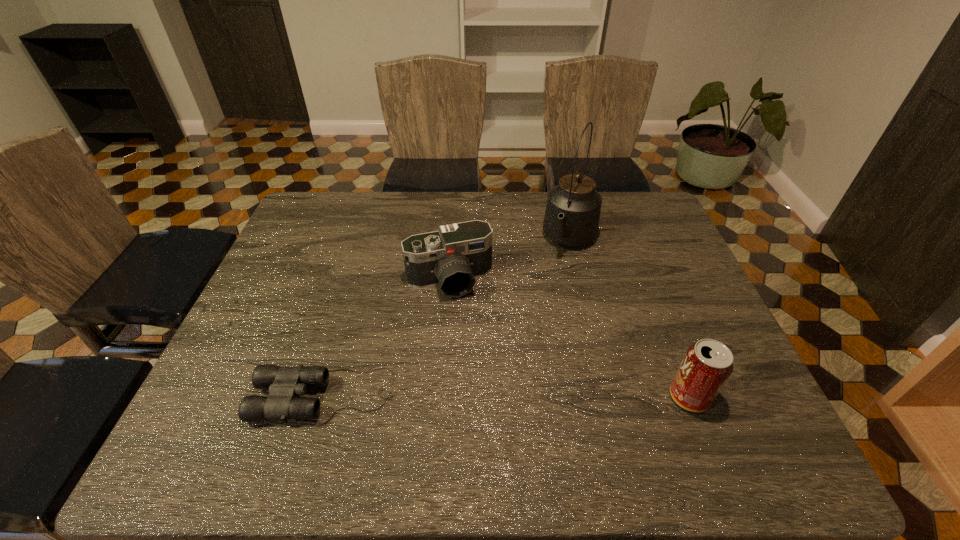
Where is `binoculars`? The width and height of the screenshot is (960, 540). binoculars is located at coordinates coord(284,383).

The image size is (960, 540). Identify the location of the rightmost object. (707, 365).

Where is `camera`? The width and height of the screenshot is (960, 540). camera is located at coordinates (454, 256).

At what (x,y) coordinates should I click in order to perform the action: click on the third object from left to right. Please return your answer as a coordinate pair (x, y). Looking at the image, I should click on (572, 214).

This screenshot has width=960, height=540. Identify the location of kettle. [x=572, y=214].

Identify the location of vacant space situated 0.100m at the eyepiece of the shortest object. This screenshot has height=540, width=960. (211, 396).

You are a GUI agent. You are given a task and a screenshot of the screen. Output one action in this format:
    pyautogui.click(x=<x>, y=<y>)
    Task: Click on the vacant space located 0.250m on the left of the soda can
    The image size is (960, 540).
    Given the screenshot: What is the action you would take?
    pyautogui.click(x=555, y=397)

Where is `free location located 0.140m on the front-facing side of the camera`? free location located 0.140m on the front-facing side of the camera is located at coordinates (473, 342).

Identify the location of free space located on the front-facing side of the camera. This screenshot has width=960, height=540. (467, 321).

Identify the location of blank space located 0.130m on the front-facing side of the camera. (472, 339).